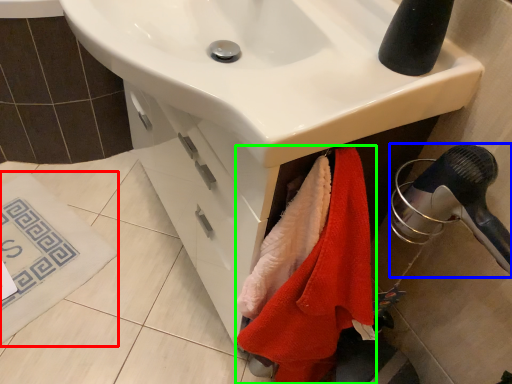
Question: Which is nearer to the bath mat (highlighted by a red box)? hair drier (highlighted by a blue box) or beach towel (highlighted by a green box).

Choices:
 (A) hair drier
 (B) beach towel

Answer: (B)